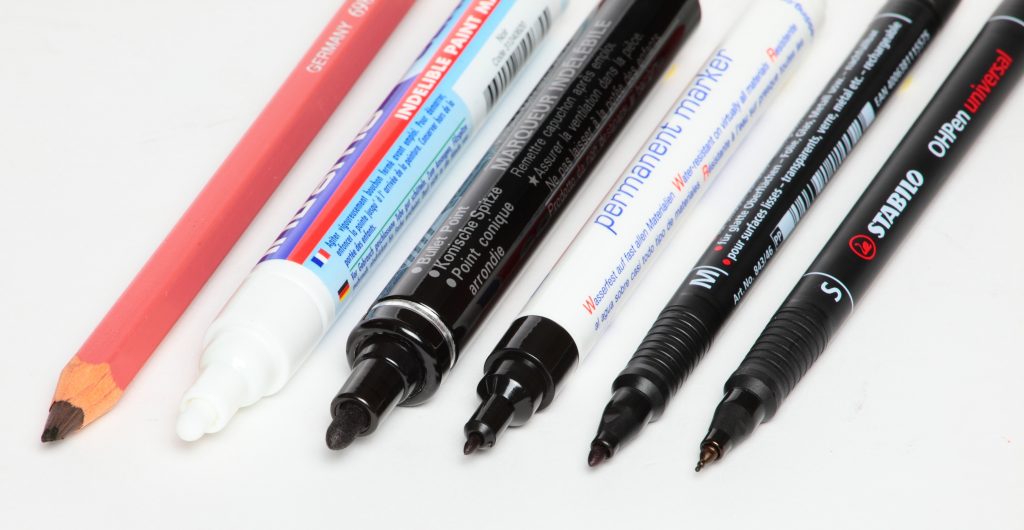
Locate an element on the screen. This screenshot has width=1024, height=530. writing utensils is located at coordinates point(271,146), point(362,176), point(502,220), point(604,240), point(705,260), point(836,280).